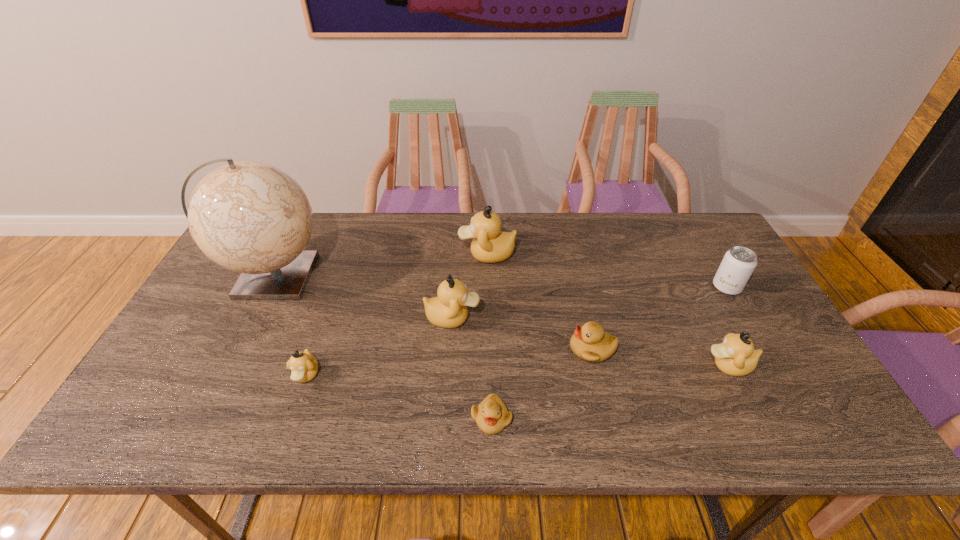
This screenshot has height=540, width=960. What are the coordinates of `the bigger yellow duckling` in the screenshot? It's located at (590, 343).

The image size is (960, 540). In order to click on the seventh object from right to left in this screenshot , I will do `click(304, 366)`.

This screenshot has width=960, height=540. I want to click on the leftmost duckling, so click(304, 366).

Where is `the nearer yellow duckling`? The height and width of the screenshot is (540, 960). the nearer yellow duckling is located at coordinates (491, 415).

Where is `the left yellow duckling`? This screenshot has width=960, height=540. the left yellow duckling is located at coordinates (491, 415).

You are a GUI agent. You are given a task and a screenshot of the screen. Output one action in this format:
    pyautogui.click(x=<x>, y=<y>)
    Task: Click on the vacant space situated on the surface of the beige globe showing Europe and Africa
    
    Given the screenshot: What is the action you would take?
    pyautogui.click(x=435, y=276)

The image size is (960, 540). I want to click on vacant region located on the face of the seventh shortest object, so click(x=398, y=254).

Identify the location of blank space located on the face of the seventh shortest object. This screenshot has width=960, height=540. (345, 254).

At what (x,y) coordinates should I click in order to perform the action: click on vacant space located on the face of the seventh shortest object. Please return your answer as a coordinate pair (x, y). The width and height of the screenshot is (960, 540). Looking at the image, I should click on (348, 254).

Image resolution: width=960 pixels, height=540 pixels. I want to click on free location located 0.240m on the face of the fifth shortest duckling, so (x=568, y=318).